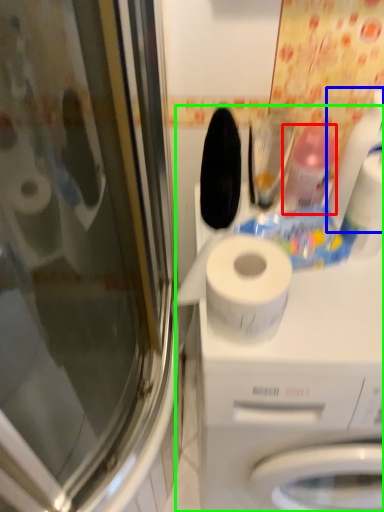
Question: Estimate the real-world distances between objects in this image. Which object is closer to cleaning product (highlighted by a red box), cleaning product (highlighted by a blue box) or machine (highlighted by a green box)?

Choices:
 (A) cleaning product
 (B) machine

Answer: (A)